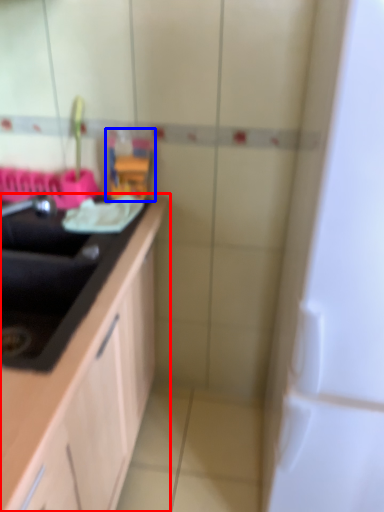
Question: Which of the following is the farthest to the observer, countertop (highlighted by a red box) or toy (highlighted by a blue box)?

Choices:
 (A) countertop
 (B) toy

Answer: (B)